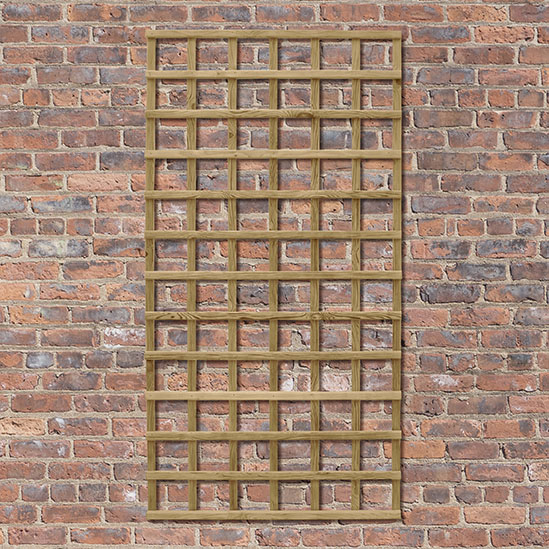
Locate an element on the screen. This screenshot has height=549, width=549. brick wall is located at coordinates (33, 268).